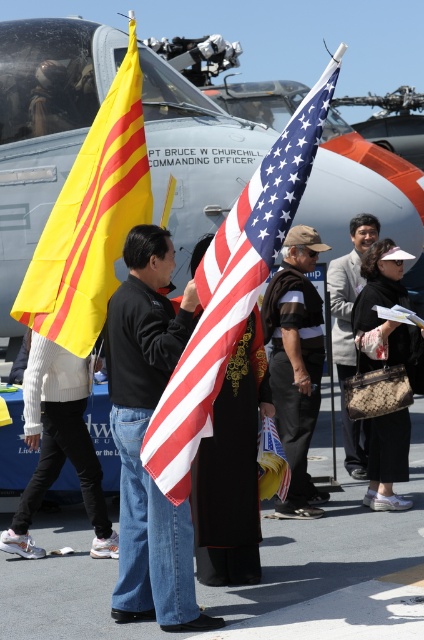
Based on the photo, is black textured bag at center positioned behind light brown leather jacket at center?

No, black textured bag at center is closer to the viewer.

Measure the distance between black textured bag at center and light brown leather jacket at center.

black textured bag at center is 1.03 meters from light brown leather jacket at center.

Find the location of a particular element. The width and height of the screenshot is (424, 640). black textured bag at center is located at coordinates (381, 307).

Measure the distance between smooth asphalt tarmac at center and khaki fabric cap at center.

smooth asphalt tarmac at center and khaki fabric cap at center are 4.69 feet apart from each other.

Locate an element on the screen. The width and height of the screenshot is (424, 640). smooth asphalt tarmac at center is located at coordinates (334, 564).

Between metallic gray aircraft at center and smooth asphalt tarmac at center, which one is positioned lower?

Positioned lower is smooth asphalt tarmac at center.

Does point (30, 193) come behind point (353, 497)?

Yes, it is.

Is point (237, 138) farther from camera compared to point (86, 554)?

That is True.

Image resolution: width=424 pixels, height=640 pixels. I want to click on metallic gray aircraft at center, so click(x=44, y=129).